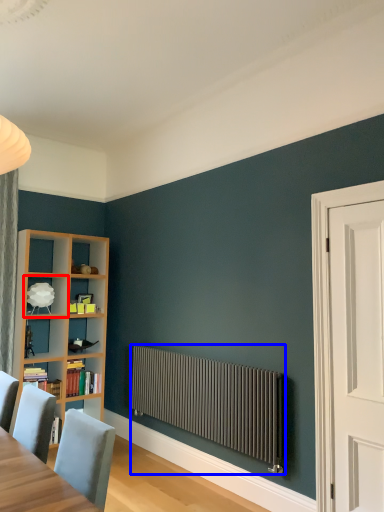
Question: Which object appears farthest to the camera in this image, shelf (highlighted by a red box) or radiator (highlighted by a blue box)?

Choices:
 (A) shelf
 (B) radiator

Answer: (A)